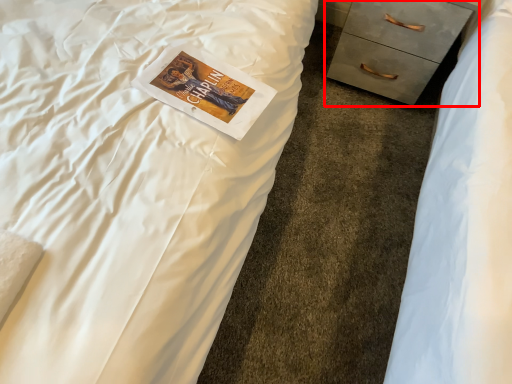
Question: From the image's perspective, considering the relative positions of chest of drawers (annotated by the red box) and paperback book in the image provided, where is chest of drawers (annotated by the red box) located with respect to the staircase?

Choices:
 (A) above
 (B) below

Answer: (A)